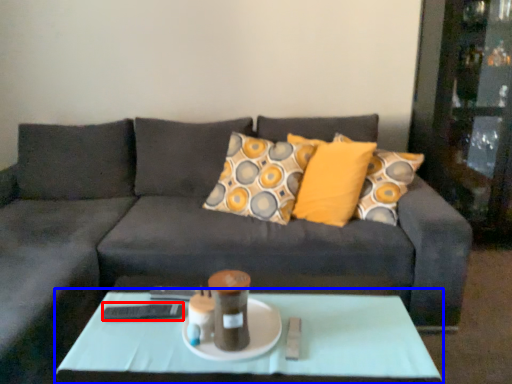
Question: Which of the following is the closest to the observer, remote (highlighted by a red box) or coffee table (highlighted by a blue box)?

Choices:
 (A) remote
 (B) coffee table

Answer: (B)